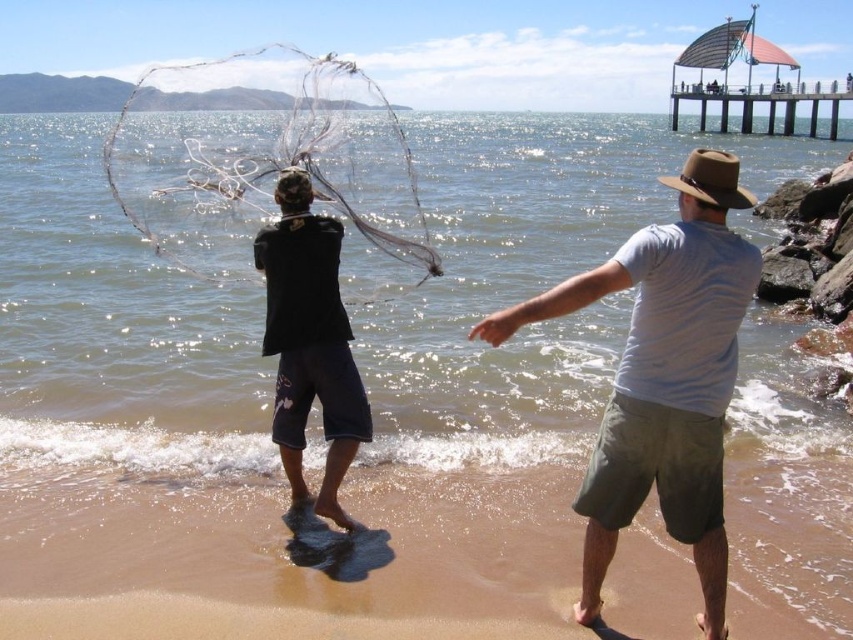
You are standing on the beach and want to retrieve the transparent nylon fishing net at center. Considering the distance, can you throw a stone to reach it?

The transparent nylon fishing net at center is 14.01 meters away from you. Since the average human can throw a stone about 15 meters, you might be able to reach it with a strong throw.

You are standing on the wooden pier at upper right and want to walk to the brown sand at lower center. Which direction should you go?

The brown sand at lower center is located below the wooden pier at upper right, so you should go downward from the wooden pier at upper right to reach the brown sand at lower center.